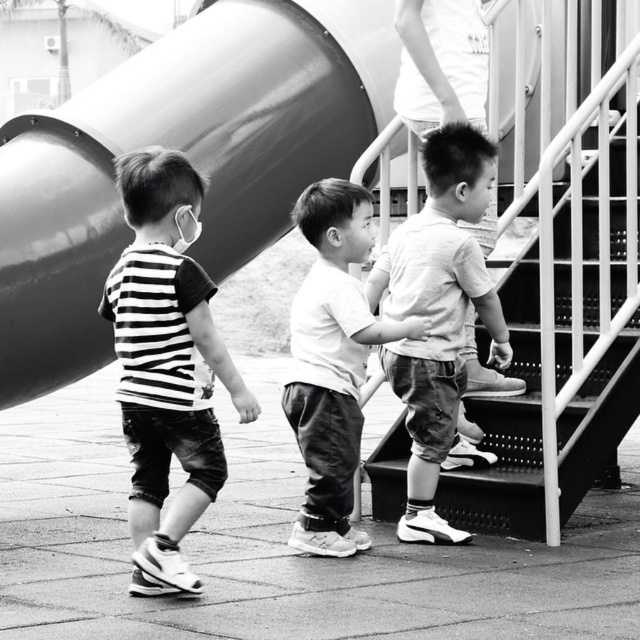
Question: Which object is farther from the camera taking this photo?

Choices:
 (A) smooth white shirt at center
 (B) smooth metal slide at upper left
 (C) striped fabric shirt at center

Answer: (B)

Question: Is striped fabric shirt at center above light gray cotton shirt at center?

Choices:
 (A) no
 (B) yes

Answer: (A)

Question: Which point appears closest to the camera in this image?

Choices:
 (A) (460, 300)
 (B) (252, 140)
 (C) (358, 340)
 (D) (195, 216)

Answer: (D)

Question: Is striped fabric shirt at center positioned in front of smooth white shirt at center?

Choices:
 (A) no
 (B) yes

Answer: (B)

Question: Does striped fabric shirt at center appear on the left side of smooth white shirt at center?

Choices:
 (A) no
 (B) yes

Answer: (B)

Question: Which object appears closest to the camera in this image?

Choices:
 (A) smooth white shirt at center
 (B) light gray cotton shirt at center
 (C) smooth metal slide at upper left

Answer: (A)